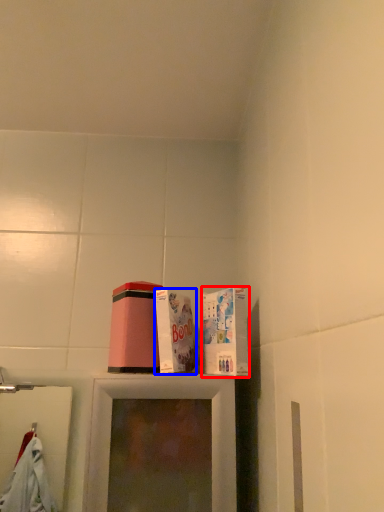
Question: Which object appears closest to the camera in this image, box (highlighted by a red box) or box (highlighted by a blue box)?

Choices:
 (A) box
 (B) box

Answer: (A)